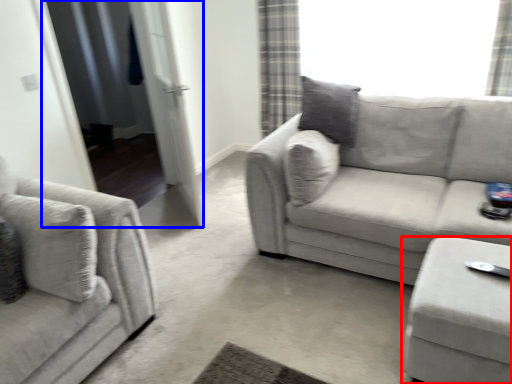
Question: Which object is closer to the camera taking this photo, table (highlighted by a red box) or screen door (highlighted by a blue box)?

Choices:
 (A) table
 (B) screen door

Answer: (A)